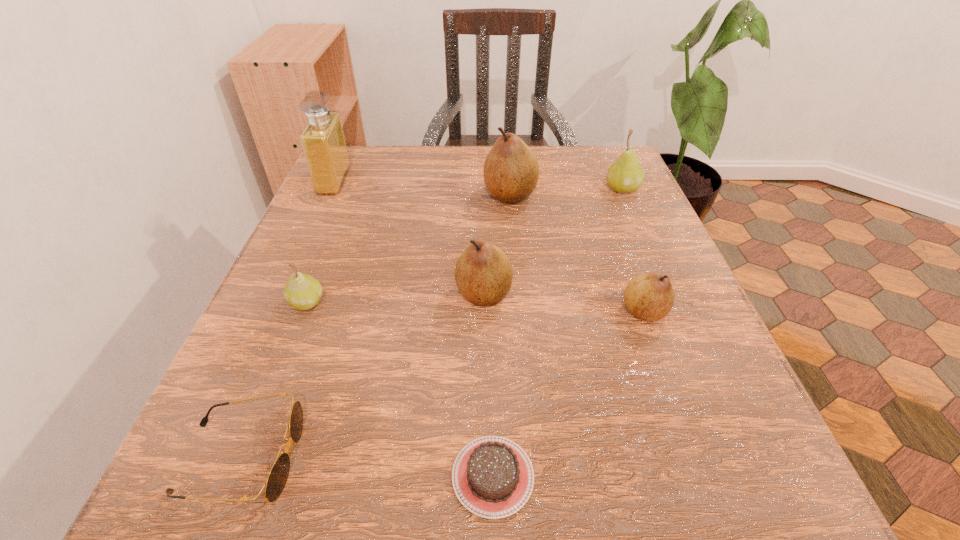
Locate an element on the screen. This screenshot has width=960, height=540. sunglasses is located at coordinates (278, 475).

Locate an element on the screen. Image resolution: width=960 pixels, height=540 pixels. brown chocolate cake is located at coordinates (492, 476).

Locate an element on the screen. This screenshot has width=960, height=540. chocolate cake is located at coordinates click(492, 476).

Image resolution: width=960 pixels, height=540 pixels. Find the location of `vacant space located 0.110m on the front-facing side of the perfume`. vacant space located 0.110m on the front-facing side of the perfume is located at coordinates (394, 181).

This screenshot has height=540, width=960. Find the location of `free space located on the front of the farthest brown pear`. free space located on the front of the farthest brown pear is located at coordinates (517, 275).

Find the location of a particular element. The height and width of the screenshot is (540, 960). vacant position located 0.370m on the front of the right green pear is located at coordinates (684, 329).

Image resolution: width=960 pixels, height=540 pixels. What are the coordinates of `free space located on the back of the second biggest brown pear` in the screenshot? It's located at (483, 212).

At what (x,y) coordinates should I click in order to perform the action: click on vacant space located 0.220m on the back of the smallest brown pear. Please return your answer as a coordinate pair (x, y). Looking at the image, I should click on (611, 219).

Image resolution: width=960 pixels, height=540 pixels. In order to click on vacant space located 0.270m on the right of the left green pear in this screenshot , I will do `click(488, 302)`.

You are a GUI agent. You are given a task and a screenshot of the screen. Output one action in this format:
    pyautogui.click(x=<x>, y=<y>)
    Task: Click on the free location located 0.130m on the lenses of the seventh tallest object
    The height and width of the screenshot is (540, 960).
    Given the screenshot: What is the action you would take?
    click(404, 458)